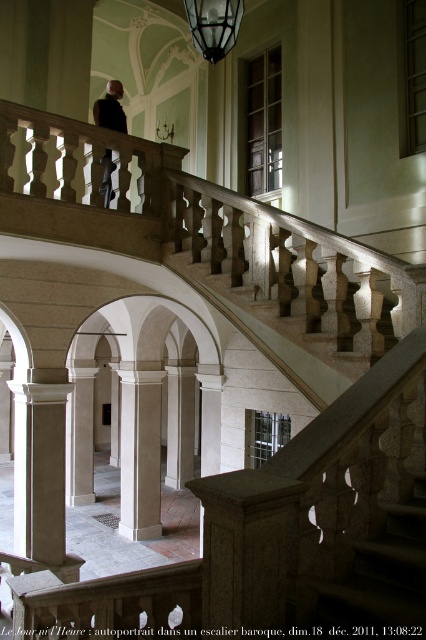
Consider the image. You are standing at the bottom of the grand staircase in the historical building. There is a point marked at coordinates point (218, 36). Can you reach that point by walking straight ahead without deviating from your current path?

The point (218, 36) is 4.07 meters away from you, so yes, you can reach it by walking straight ahead since it is within a reasonable distance and there are no obstacles mentioned in the scene description.

You are an interior designer assessing the proportions of the staircase area. The matte glass lamp at upper center and the dark gray suit at upper center are both in your line of sight. Which object is taller?

The dark gray suit at upper center is taller than the matte glass lamp at upper center.